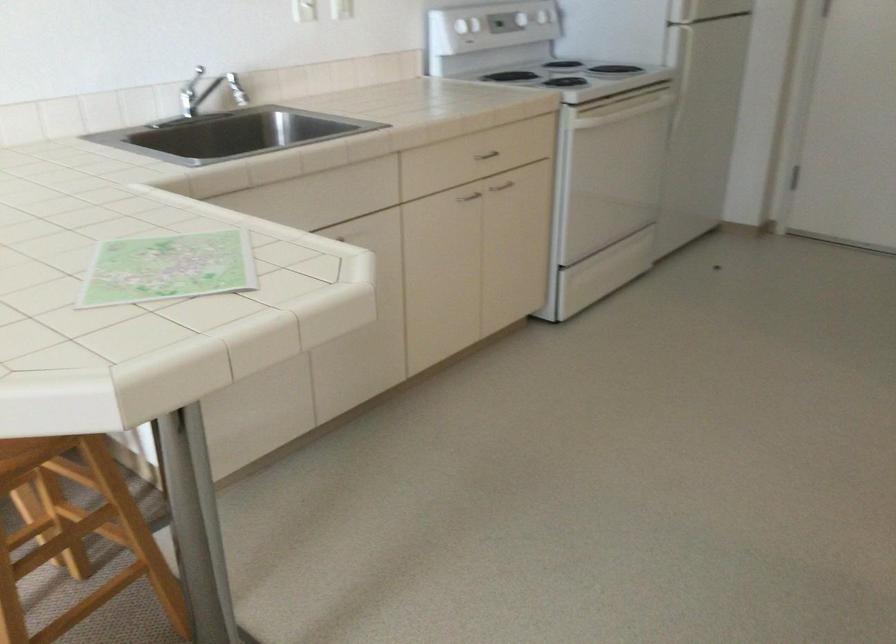
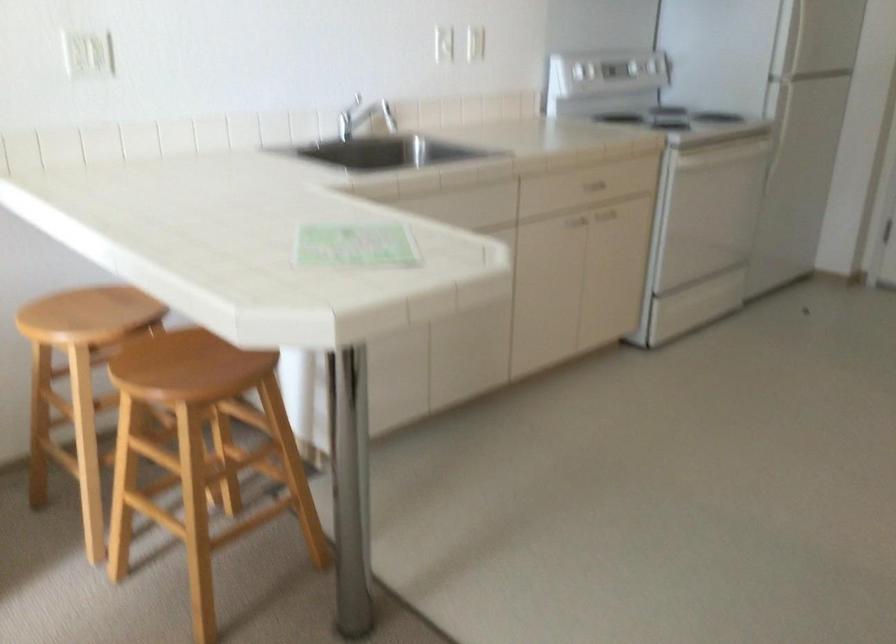
Where in the second image is the point corresponding to (222,84) from the first image?

(375, 111)